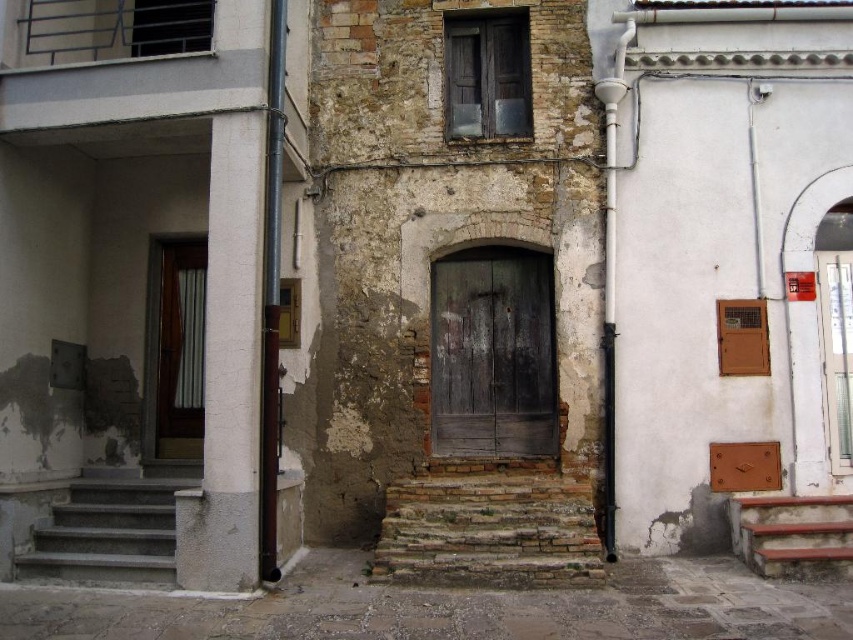
Question: Can you confirm if rustic stone stairs at center is smaller than rustic wooden stairs at lower right?

Choices:
 (A) no
 (B) yes

Answer: (A)

Question: Is dark brown wooden door at center positioned in front of gray concrete stairs at lower left?

Choices:
 (A) no
 (B) yes

Answer: (A)

Question: Does rustic stone stairs at center appear on the left side of gray concrete stairs at lower left?

Choices:
 (A) no
 (B) yes

Answer: (A)

Question: Which object is the closest to the dark brown wooden door at center?

Choices:
 (A) rustic wooden stairs at lower right
 (B) white wood door at center
 (C) rustic stone stairs at center

Answer: (C)

Question: Which object appears closest to the camera in this image?

Choices:
 (A) dark brown wooden door at center
 (B) rustic stone stairs at center

Answer: (B)

Question: Which of the following is the closest to the observer?

Choices:
 (A) rustic stone stairs at center
 (B) dark brown wooden door at center

Answer: (A)